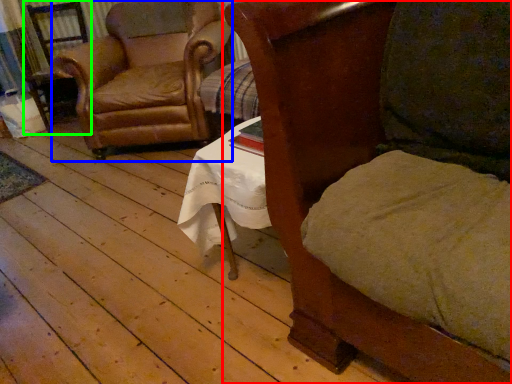
Question: Which object is the closest to the chair (highlighted by a red box)? Choose among these: chair (highlighted by a blue box) or armchair (highlighted by a green box).

Choices:
 (A) chair
 (B) armchair

Answer: (A)